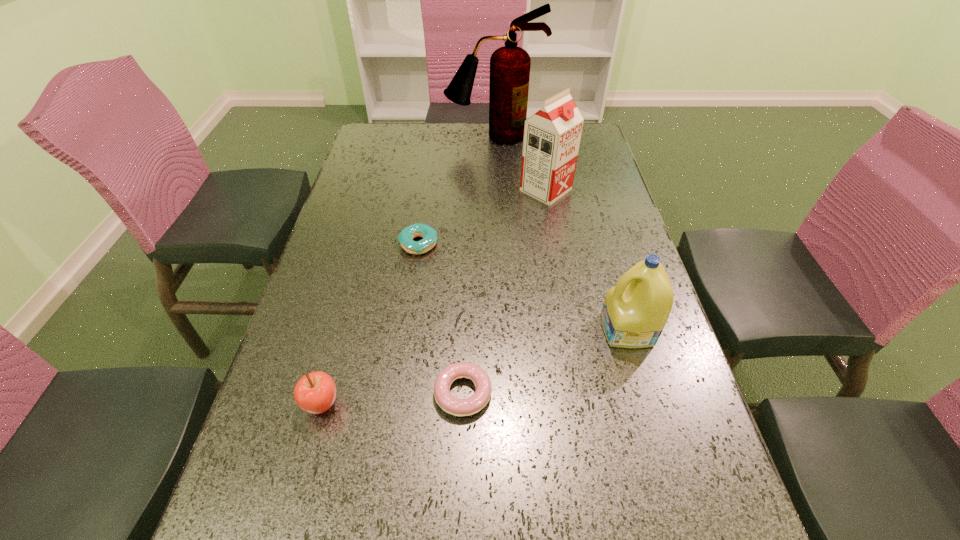
I want to click on object present at the left edge, so click(x=315, y=392).

Identify the location of soya milk at the right edge. This screenshot has width=960, height=540. coord(552,135).

Locate an element on the screen. This screenshot has width=960, height=540. detergent present at the right edge is located at coordinates (635, 311).

In the image, there is a desktop. At what (x,y) coordinates should I click in order to perform the action: click on vacant space at the left edge. Please return your answer as a coordinate pair (x, y). Looking at the image, I should click on (389, 209).

In the image, there is a desktop. At what (x,y) coordinates should I click in order to perform the action: click on free space at the right edge. Please return your answer as a coordinate pair (x, y). Looking at the image, I should click on (660, 493).

The image size is (960, 540). What are the coordinates of `free region at the far right corner` in the screenshot? It's located at [595, 153].

Find the location of a particular element. free spot between the leftmost object and the soya milk is located at coordinates (434, 297).

The width and height of the screenshot is (960, 540). Find the location of `vacant space that is in between the second tallest object and the right doughnut`. vacant space that is in between the second tallest object and the right doughnut is located at coordinates click(x=504, y=292).

Locate an element on the screen. This screenshot has width=960, height=540. free point between the fourth shortest object and the farther doughnut is located at coordinates (523, 287).

You are a GUI agent. You are given a task and a screenshot of the screen. Output one action in this format:
    pyautogui.click(x=<x>, y=<y>)
    Task: Click on the free point between the third tallest object and the third farthest object
    
    Given the screenshot: What is the action you would take?
    pyautogui.click(x=523, y=287)